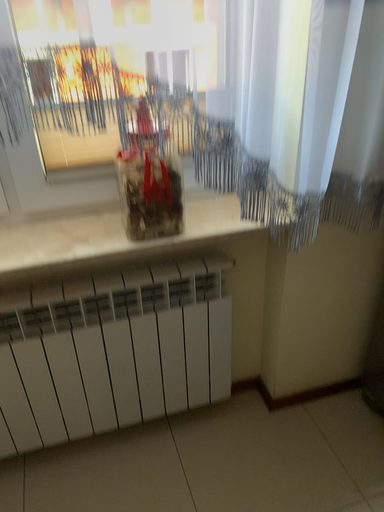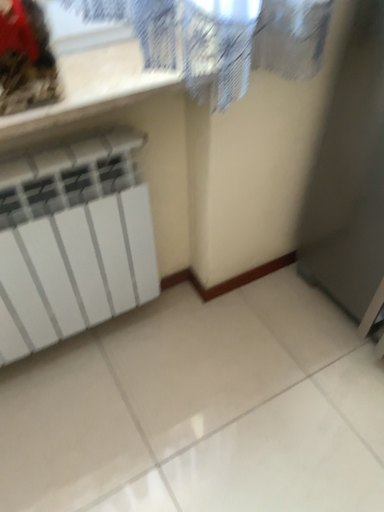
Question: Which way did the camera rotate in the video?

Choices:
 (A) rotated left
 (B) rotated right

Answer: (B)